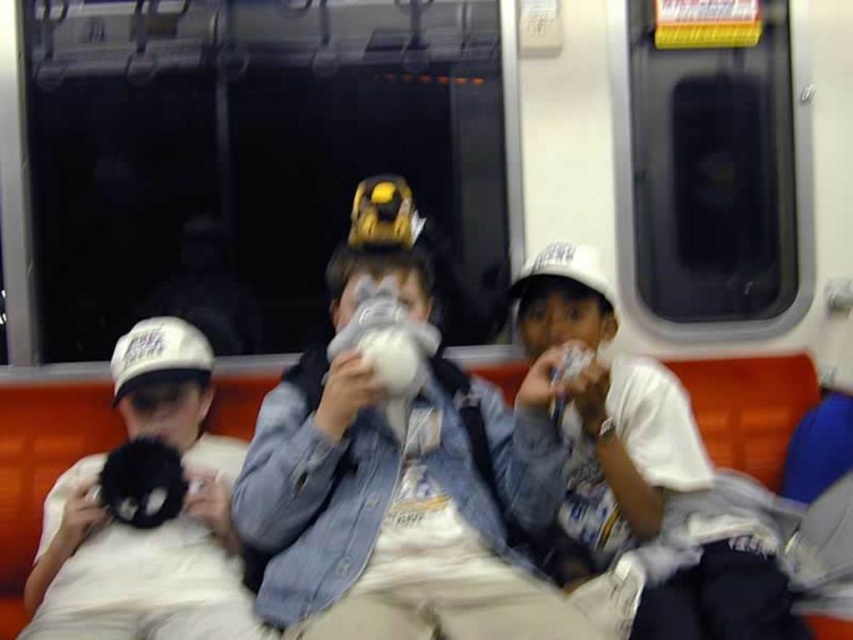
Is white cotton shirt at right further to camera compared to black plush toy at left?

No, it is not.

Who is shorter, white cotton shirt at right or black plush toy at left?

Standing shorter between the two is black plush toy at left.

Describe the element at coordinates (646, 481) in the screenshot. This screenshot has height=640, width=853. I see `white cotton shirt at right` at that location.

Where is `white cotton shirt at right`? The width and height of the screenshot is (853, 640). white cotton shirt at right is located at coordinates pyautogui.click(x=646, y=481).

Is denim jacket at center taller than white cotton shirt at right?

Indeed, denim jacket at center has a greater height compared to white cotton shirt at right.

Which is below, denim jacket at center or white cotton shirt at right?

Positioned lower is white cotton shirt at right.

Describe the element at coordinates (402, 506) in the screenshot. I see `denim jacket at center` at that location.

This screenshot has height=640, width=853. In order to click on denim jacket at center in this screenshot , I will do `click(402, 506)`.

Does denim jacket at center appear over black plush toy at left?

Yes, denim jacket at center is above black plush toy at left.

Does denim jacket at center have a smaller size compared to black plush toy at left?

No.

Find the location of a particular element. denim jacket at center is located at coordinates (402, 506).

You are a GUI agent. You are given a task and a screenshot of the screen. Output one action in this format:
    pyautogui.click(x=<x>, y=<y>)
    Task: Click on the denim jacket at center
    
    Given the screenshot: What is the action you would take?
    pyautogui.click(x=402, y=506)